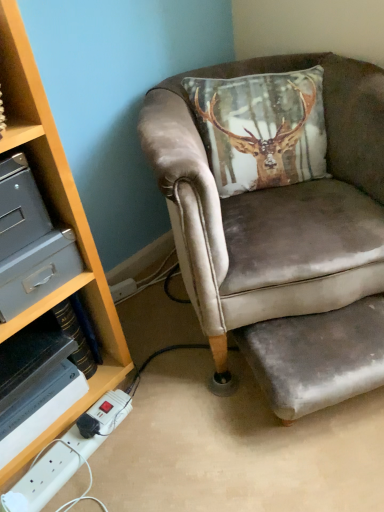
Locate an element on the screen. The image size is (384, 512). vacant area on top of white plastic power strip at lower left (from a real-world perspective) is located at coordinates (69, 452).